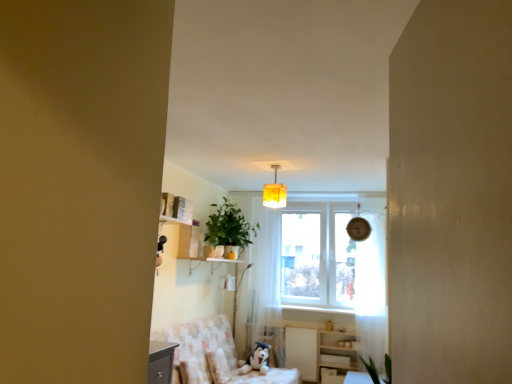
Where is `blank space above yellow fabric lampshade at center (from a real-world perspective)`? blank space above yellow fabric lampshade at center (from a real-world perspective) is located at coordinates (x=277, y=162).